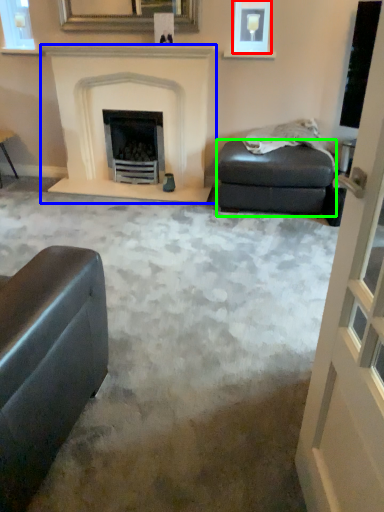
Question: Considering the real-world distances, which object is closest to picture frame (highlighted by a red box)? fireplace (highlighted by a blue box) or footrest (highlighted by a green box).

Choices:
 (A) fireplace
 (B) footrest

Answer: (A)